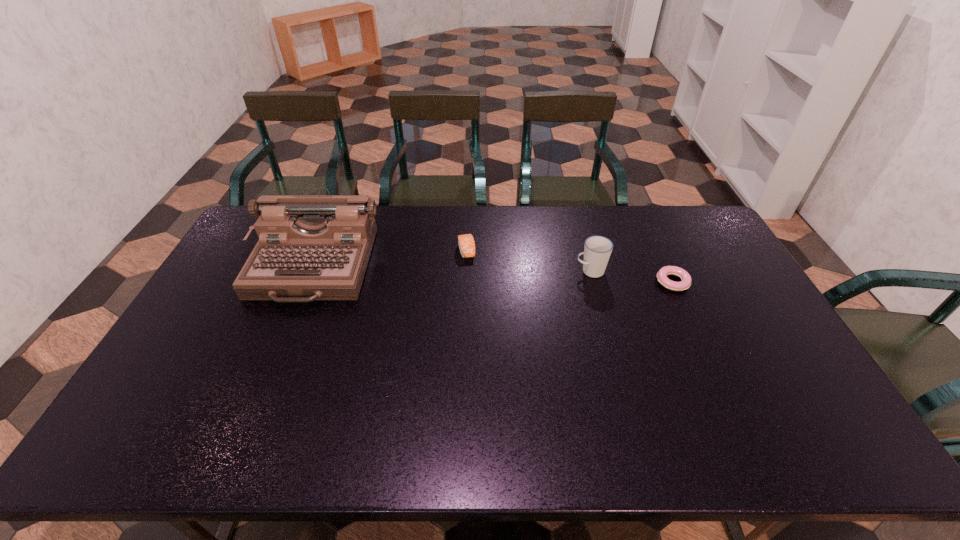
You are a GUI agent. You are given a task and a screenshot of the screen. Output one action in this format:
    pyautogui.click(x=<x>, y=<y>)
    Task: Click on the empty location between the shortest object and the typewriter
    The width and height of the screenshot is (960, 540).
    Given the screenshot: What is the action you would take?
    pyautogui.click(x=492, y=274)

Identify the location of vacant area that lies between the third shortest object and the tallest object. This screenshot has width=960, height=540. (451, 269).

Locate an element on the screen. empty location between the doughnut and the tallest object is located at coordinates (492, 274).

Where is `the third closest object relative to the second shortest object`? This screenshot has width=960, height=540. the third closest object relative to the second shortest object is located at coordinates (685, 283).

Identify the location of object that can be found as the second closest to the rightmost object. The image size is (960, 540). [466, 243].

Find the location of `blank space that satisfies the following two spatial constraints: 1. on the front side of the doughnut; 2. on the left side of the second shortest object`. blank space that satisfies the following two spatial constraints: 1. on the front side of the doughnut; 2. on the left side of the second shortest object is located at coordinates (466, 282).

I want to click on free space that satisfies the following two spatial constraints: 1. on the keyboard of the leftmost object; 2. on the right side of the rightmost object, so click(x=305, y=282).

The height and width of the screenshot is (540, 960). Find the location of `free spot that satisfies the following two spatial constraints: 1. on the keyboard of the doughnut; 2. on the left side of the tallest object`. free spot that satisfies the following two spatial constraints: 1. on the keyboard of the doughnut; 2. on the left side of the tallest object is located at coordinates (305, 282).

Image resolution: width=960 pixels, height=540 pixels. Identify the location of free spot that satisfies the following two spatial constraints: 1. on the back side of the rightmost object; 2. with a handle on the side of the third shortest object. (667, 271).

Locate an element on the screen. The image size is (960, 540). vacant point that satisfies the following two spatial constraints: 1. on the back side of the doughnut; 2. with a handle on the side of the cup is located at coordinates (667, 271).